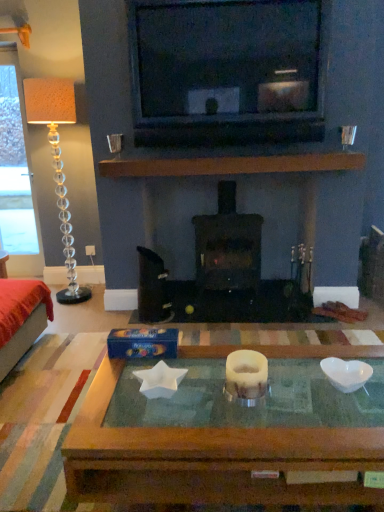
Question: Does black matte wood burning stove at center have a greater height compared to translucent glass coffee table at center?

Choices:
 (A) yes
 (B) no

Answer: (A)

Question: From the image's perspective, does black matte wood burning stove at center appear lower than translucent glass coffee table at center?

Choices:
 (A) yes
 (B) no

Answer: (B)

Question: Can you confirm if black matte wood burning stove at center is wider than translucent glass coffee table at center?

Choices:
 (A) yes
 (B) no

Answer: (B)

Question: From the image's perspective, is black matte wood burning stove at center over translucent glass coffee table at center?

Choices:
 (A) yes
 (B) no

Answer: (A)

Question: Is black matte wood burning stove at center beside translucent glass coffee table at center?

Choices:
 (A) yes
 (B) no

Answer: (B)

Question: Considering the positions of point (54, 103) and point (221, 381), is point (54, 103) closer or farther from the camera than point (221, 381)?

Choices:
 (A) closer
 (B) farther

Answer: (B)

Question: Which is correct: translucent glass floor lamp at left is inside translucent glass coffee table at center, or outside of it?

Choices:
 (A) outside
 (B) inside

Answer: (A)

Question: From their relative heights in the image, would you say translucent glass floor lamp at left is taller or shorter than translucent glass coffee table at center?

Choices:
 (A) tall
 (B) short

Answer: (A)

Question: Is translucent glass floor lamp at left in front of or behind translucent glass coffee table at center in the image?

Choices:
 (A) behind
 (B) front

Answer: (A)

Question: From a real-world perspective, relative to translucent glass floor lamp at left, is translucent glass coffee table at center vertically above or below?

Choices:
 (A) below
 (B) above

Answer: (A)

Question: Which is correct: translucent glass coffee table at center is inside translucent glass floor lamp at left, or outside of it?

Choices:
 (A) outside
 (B) inside

Answer: (A)

Question: In terms of size, does translucent glass coffee table at center appear bigger or smaller than translucent glass floor lamp at left?

Choices:
 (A) big
 (B) small

Answer: (A)

Question: Considering their positions, is translucent glass coffee table at center located in front of or behind translucent glass floor lamp at left?

Choices:
 (A) front
 (B) behind

Answer: (A)

Question: Would you say velvet red ottoman at left is to the left or to the right of translucent glass floor lamp at left in the picture?

Choices:
 (A) left
 (B) right

Answer: (A)

Question: Looking at their shapes, would you say velvet red ottoman at left is wider or thinner than translucent glass floor lamp at left?

Choices:
 (A) thin
 (B) wide

Answer: (B)